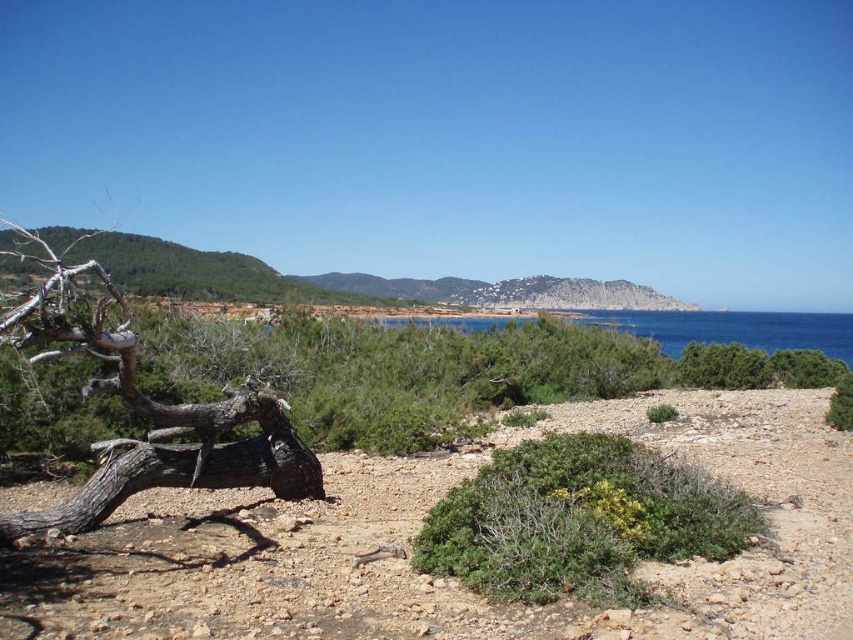
Question: Which point is closer to the camera?

Choices:
 (A) green shrub at center
 (B) dark gray bark tree at left

Answer: (A)

Question: Among these points, which one is farthest from the camera?

Choices:
 (A) (54, 330)
 (B) (505, 538)
 (C) (515, 433)

Answer: (C)

Question: Can you confirm if green shrub at center is thinner than dark gray bark tree at left?

Choices:
 (A) no
 (B) yes

Answer: (B)

Question: Which point is farther from the camera taking this photo?

Choices:
 (A) (787, 600)
 (B) (425, 545)
 (C) (265, 484)

Answer: (C)

Question: From the image, what is the correct spatial relationship of green shrub at center in relation to dark gray bark tree at left?

Choices:
 (A) above
 (B) below

Answer: (B)

Question: Can you confirm if brown rocky beach at lower center is positioned below dark gray bark tree at left?

Choices:
 (A) yes
 (B) no

Answer: (A)